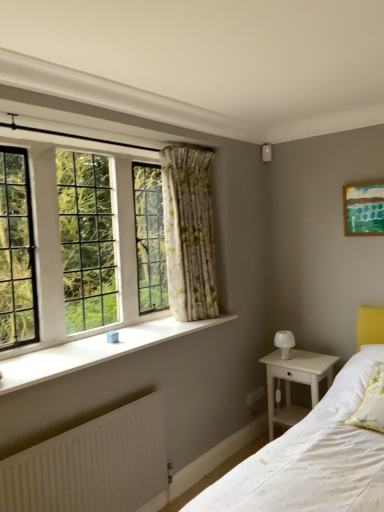
Question: Considering the relative sizes of white wood nightstand at lower right and white soft pillow at lower right in the image provided, is white wood nightstand at lower right bigger than white soft pillow at lower right?

Choices:
 (A) yes
 (B) no

Answer: (A)

Question: Does white wood nightstand at lower right have a lesser width compared to white soft pillow at lower right?

Choices:
 (A) no
 (B) yes

Answer: (B)

Question: Does white wood nightstand at lower right come behind white soft pillow at lower right?

Choices:
 (A) yes
 (B) no

Answer: (A)

Question: Considering the relative sizes of white wood nightstand at lower right and white soft pillow at lower right in the image provided, is white wood nightstand at lower right taller than white soft pillow at lower right?

Choices:
 (A) yes
 (B) no

Answer: (A)

Question: Is white wood nightstand at lower right placed right next to white soft pillow at lower right?

Choices:
 (A) yes
 (B) no

Answer: (B)

Question: Can you confirm if white wood nightstand at lower right is wider than white soft pillow at lower right?

Choices:
 (A) yes
 (B) no

Answer: (B)

Question: Is clear glass windows at upper left not within green textured canvas at upper right?

Choices:
 (A) yes
 (B) no

Answer: (A)

Question: Is green textured canvas at upper right at the back of clear glass windows at upper left?

Choices:
 (A) yes
 (B) no

Answer: (B)

Question: Would you say clear glass windows at upper left contains green textured canvas at upper right?

Choices:
 (A) no
 (B) yes

Answer: (A)

Question: Does clear glass windows at upper left have a smaller size compared to green textured canvas at upper right?

Choices:
 (A) yes
 (B) no

Answer: (B)

Question: Can you confirm if clear glass windows at upper left is positioned to the right of green textured canvas at upper right?

Choices:
 (A) yes
 (B) no

Answer: (B)

Question: Considering the relative positions of clear glass windows at upper left and green textured canvas at upper right in the image provided, is clear glass windows at upper left to the left of green textured canvas at upper right from the viewer's perspective?

Choices:
 (A) yes
 (B) no

Answer: (A)

Question: Would you say clear glass windows at upper left contains white wood nightstand at lower right?

Choices:
 (A) no
 (B) yes

Answer: (A)